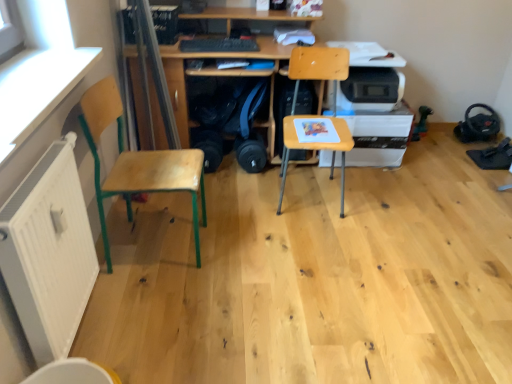
Identify the location of vacant area on top of white matte radiator at lower left (from a real-world perspective). The image size is (512, 384). pos(34,170).